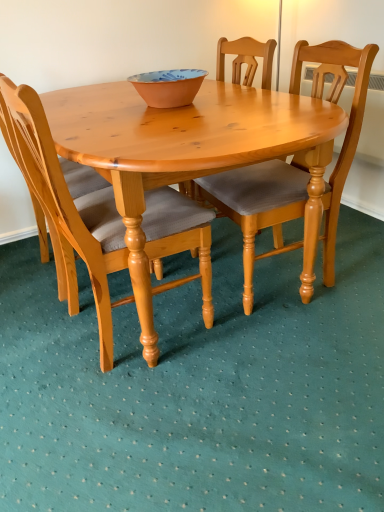
Locate an element on the screen. Image resolution: width=384 pixels, height=512 pixels. vacant area that is in front of light brown wood chair at center, the second chair viewed from the left is located at coordinates (291, 346).